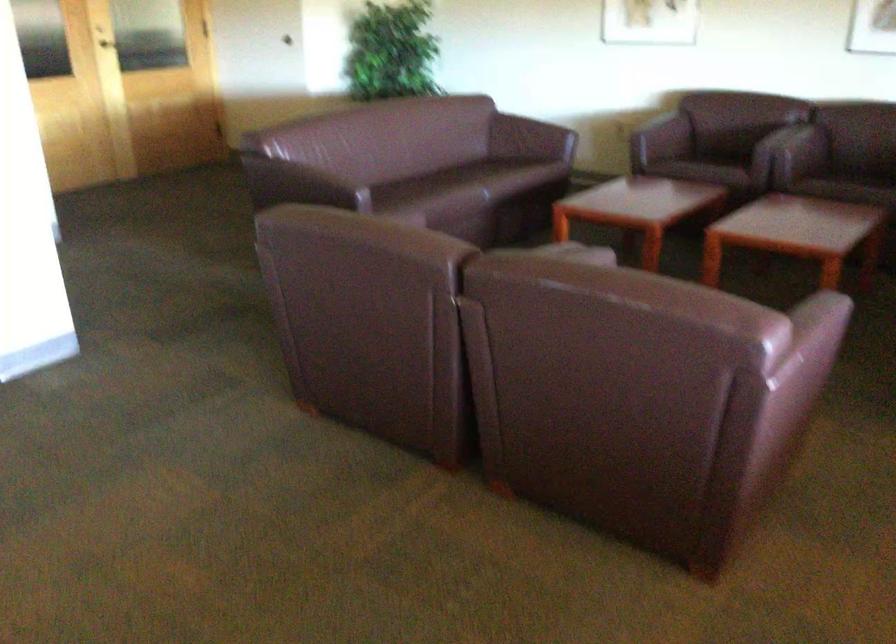
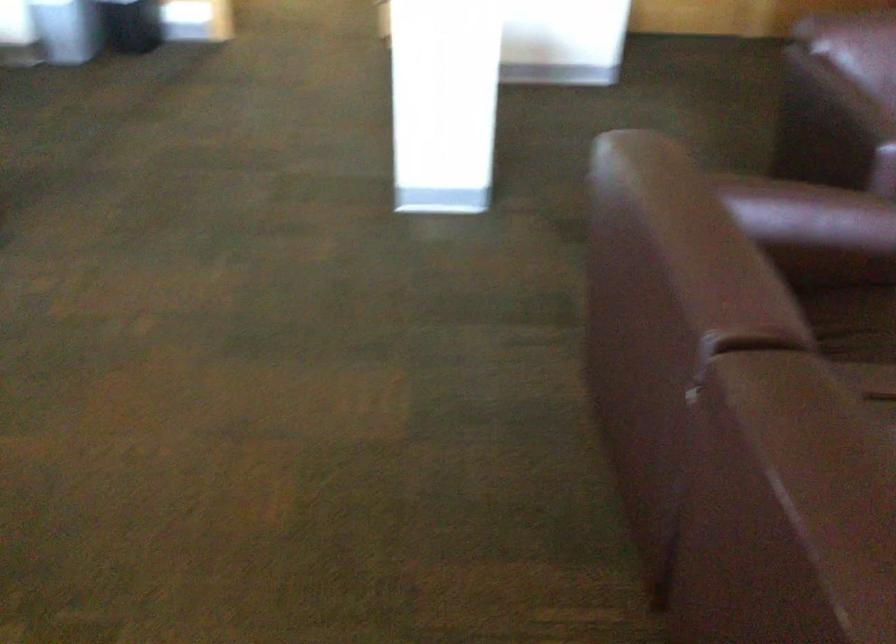
Where in the second image is the point corresponding to [314,185] from the first image?

(832, 118)